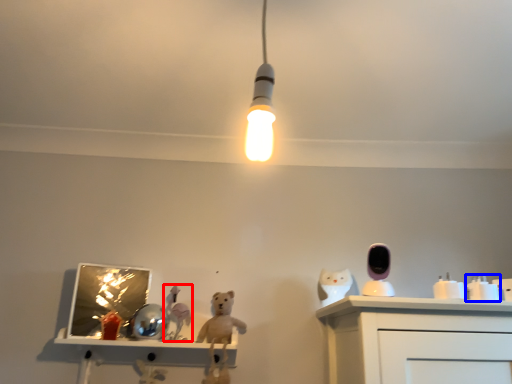
Question: Which of the following is the closest to the observer, toy (highlighted by a red box) or toy (highlighted by a blue box)?

Choices:
 (A) toy
 (B) toy

Answer: (B)